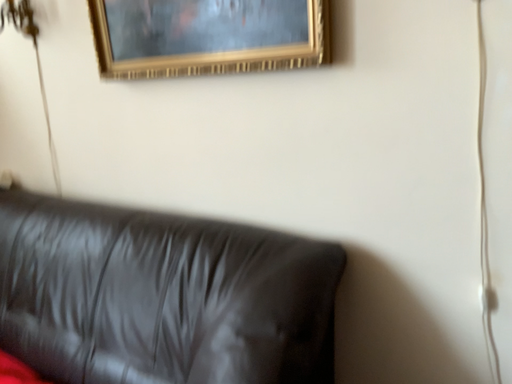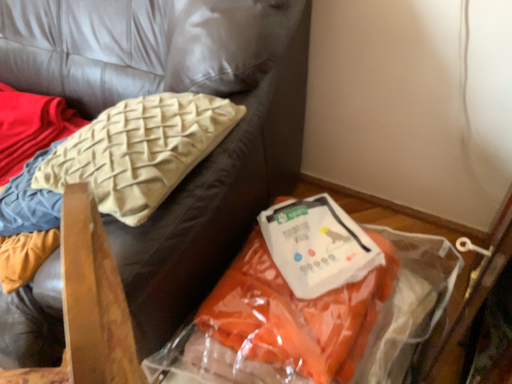
Question: How did the camera likely rotate when shooting the video?

Choices:
 (A) rotated downward
 (B) rotated upward

Answer: (A)